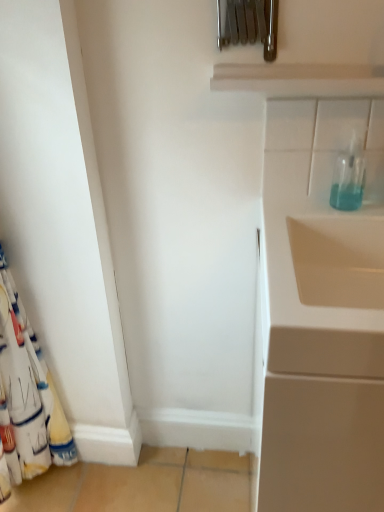
Question: Is transparent glass bottle at upper right smaller than white fabric curtain at left?

Choices:
 (A) no
 (B) yes

Answer: (B)

Question: Would you say white fabric curtain at left is part of transparent glass bottle at upper right's contents?

Choices:
 (A) no
 (B) yes

Answer: (A)

Question: Is transparent glass bottle at upper right at the left side of white fabric curtain at left?

Choices:
 (A) yes
 (B) no

Answer: (B)

Question: Can you confirm if transparent glass bottle at upper right is shorter than white fabric curtain at left?

Choices:
 (A) yes
 (B) no

Answer: (A)

Question: Does transparent glass bottle at upper right lie behind white fabric curtain at left?

Choices:
 (A) no
 (B) yes

Answer: (B)

Question: Is white fabric curtain at left in front of or behind white glossy cabinet at right in the image?

Choices:
 (A) behind
 (B) front

Answer: (A)

Question: Considering the positions of white fabric curtain at left and white glossy cabinet at right in the image, is white fabric curtain at left taller or shorter than white glossy cabinet at right?

Choices:
 (A) tall
 (B) short

Answer: (A)

Question: Would you say white fabric curtain at left is to the left or to the right of white glossy cabinet at right in the picture?

Choices:
 (A) left
 (B) right

Answer: (A)

Question: From a real-world perspective, relative to white glossy cabinet at right, is white fabric curtain at left vertically above or below?

Choices:
 (A) above
 (B) below

Answer: (A)

Question: From their relative heights in the image, would you say white fabric curtain at left is taller or shorter than transparent glass bottle at upper right?

Choices:
 (A) short
 (B) tall

Answer: (B)

Question: Is point (34, 421) positioned closer to the camera than point (349, 194)?

Choices:
 (A) farther
 (B) closer

Answer: (A)

Question: Is white fabric curtain at left bigger or smaller than transparent glass bottle at upper right?

Choices:
 (A) small
 (B) big

Answer: (B)

Question: From a real-world perspective, is white fabric curtain at left above or below transparent glass bottle at upper right?

Choices:
 (A) below
 (B) above

Answer: (A)

Question: Considering the positions of point (337, 205) and point (41, 366), is point (337, 205) closer or farther from the camera than point (41, 366)?

Choices:
 (A) closer
 (B) farther

Answer: (A)

Question: Considering the positions of transparent glass bottle at upper right and white fabric curtain at left in the image, is transparent glass bottle at upper right bigger or smaller than white fabric curtain at left?

Choices:
 (A) small
 (B) big

Answer: (A)